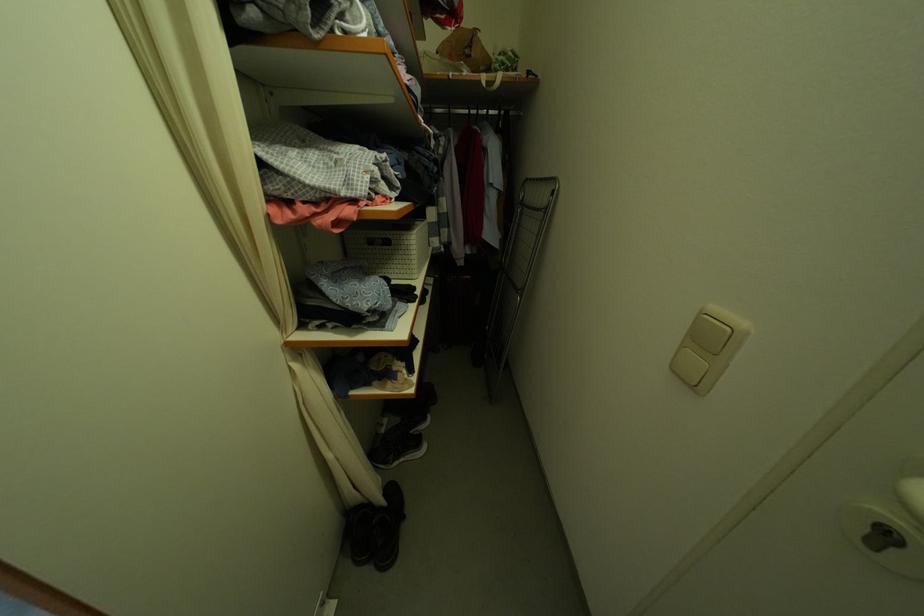
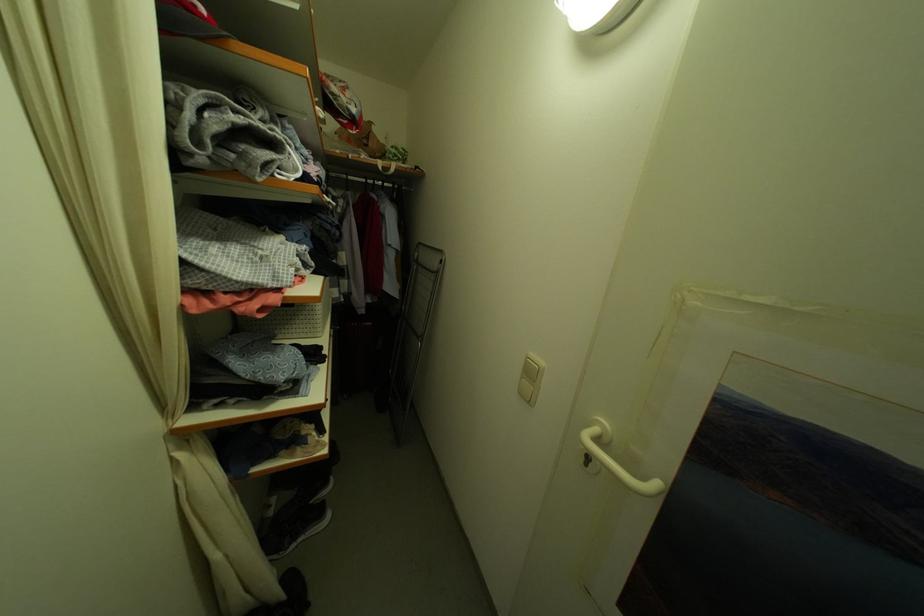
Question: The camera is either moving clockwise (left) or counter-clockwise (right) around the object. The first image is from the beginning of the video and the second image is from the end. Is the camera moving left or right when shooting the video?

Choices:
 (A) Left
 (B) Right

Answer: (A)